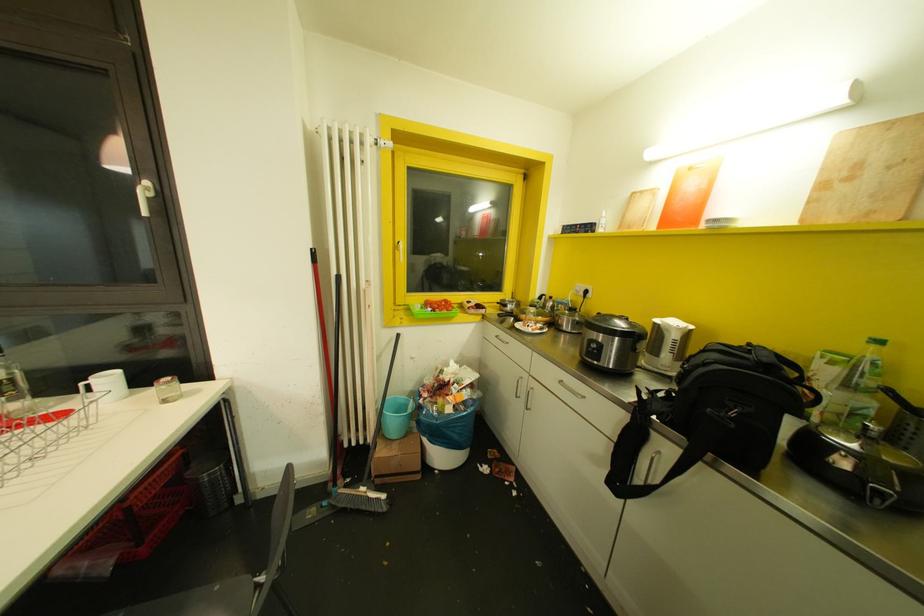
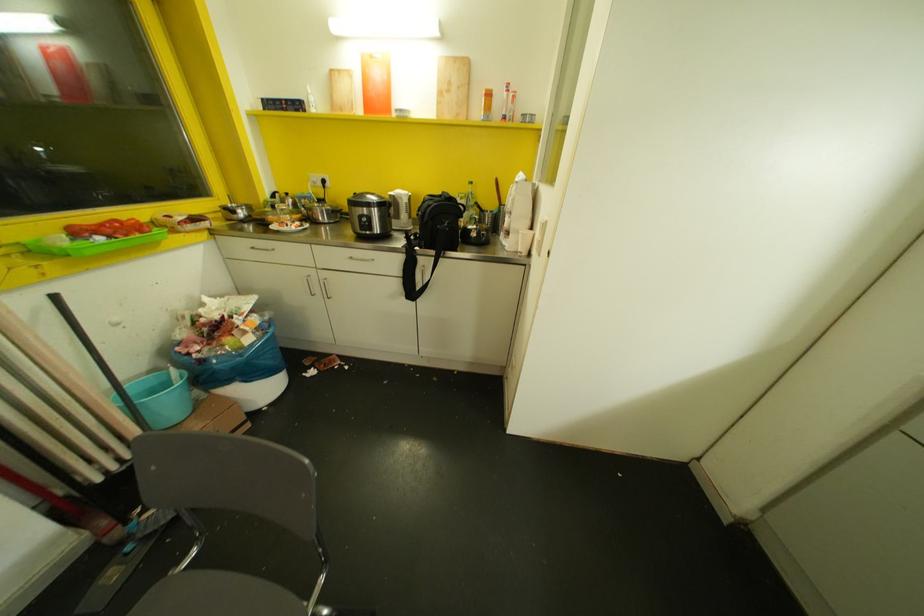
The point at (572, 310) is marked in the first image. Where is the corresponding point in the second image?

(320, 200)